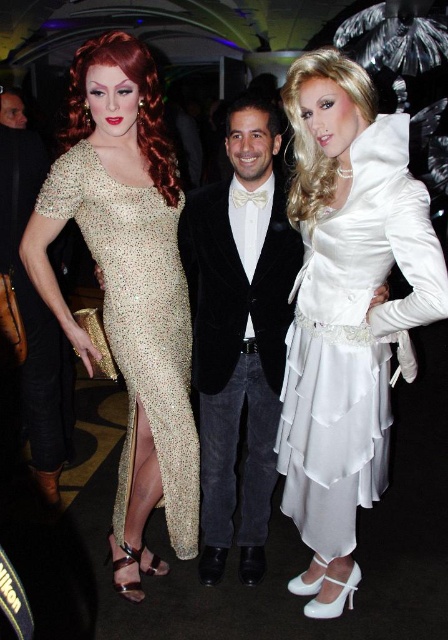
Who is shorter, velvet black blazer at center or sparkly gold dress at left?

sparkly gold dress at left

Looking at this image, between velvet black blazer at center and sparkly gold dress at left, which one has more height?

With more height is velvet black blazer at center.

Is point (210, 195) closer to camera compared to point (158, 330)?

No, it is behind (158, 330).

At what (x,y) coordinates should I click in order to perform the action: click on velvet black blazer at center. Please return your answer as a coordinate pair (x, y). The width and height of the screenshot is (448, 640). Looking at the image, I should click on (238, 332).

Describe the element at coordinates (353, 337) in the screenshot. I see `white satin dress at right` at that location.

Can you confirm if white satin dress at right is smaller than sparkly gold dress at left?

Incorrect, white satin dress at right is not smaller in size than sparkly gold dress at left.

Which is in front, point (375, 248) or point (125, 433)?

Point (375, 248) is more forward.

Where is `white satin dress at right`? The image size is (448, 640). white satin dress at right is located at coordinates (353, 337).

Who is higher up, white satin dress at right or velvet black blazer at center?

velvet black blazer at center is above.

Is point (328, 260) closer to camera compared to point (280, 257)?

Yes, point (328, 260) is closer to viewer.

Locate an element on the screen. white satin dress at right is located at coordinates (x=353, y=337).